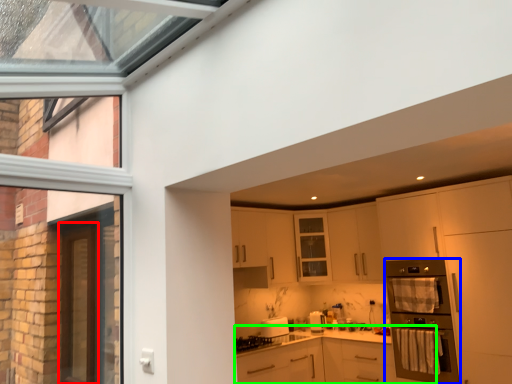
Question: Which object is positioned farthest from screen door (highlighted by a red box)? Select from home appliance (highlighted by a blue box) and cabinetry (highlighted by a green box).

Choices:
 (A) home appliance
 (B) cabinetry

Answer: (A)